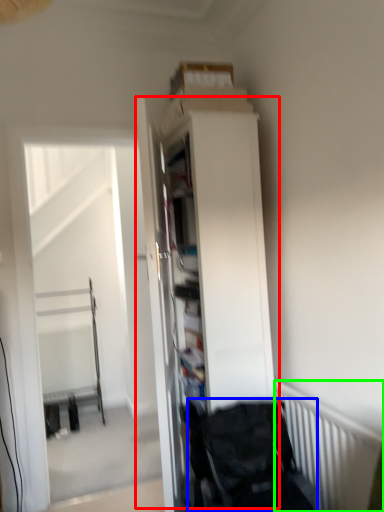
Question: Which object is positioned farthest from dresser (highlighted by a red box)? Select from baby carriage (highlighted by a blue box) and radiator (highlighted by a green box).

Choices:
 (A) baby carriage
 (B) radiator

Answer: (B)